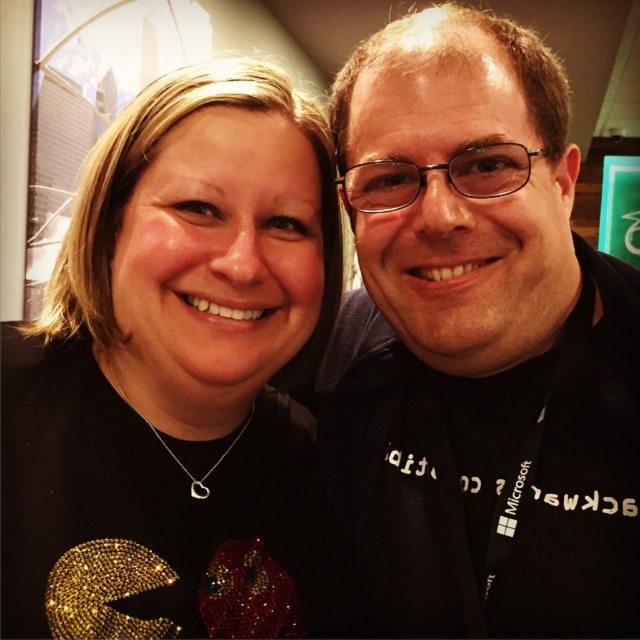
You are a photographer standing at a distance of 20 inches from the subject. You want to take a closeup shot of the black matte shirt at center. Is the subject currently positioned at the correct distance for your desired shot?

The black matte shirt at center is 20.16 inches from the camera, which is very close to your desired 20 inches. The subject is positioned at the correct distance for your closeup shot.